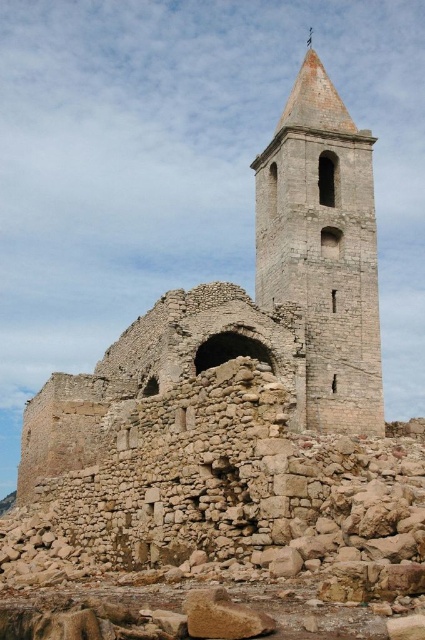
You are an archaeologist examining the ruins. You need to determine which structure is taller between the rustic stone ruins at center and the stone bell tower at center. Based on the scene, which one is taller?

The rustic stone ruins at center is taller than the stone bell tower at center according to the description provided.

In the scene shown: You are a drone operator trying to land a drone on a flat surface. You see the point marked at coordinates (254, 300). Based on the scene, is this point located on a flat surface suitable for landing?

The point (254, 300) is on rustic stone ruins at center, which are described as uneven and partially collapsed. Therefore, this point is not on a flat surface suitable for landing.